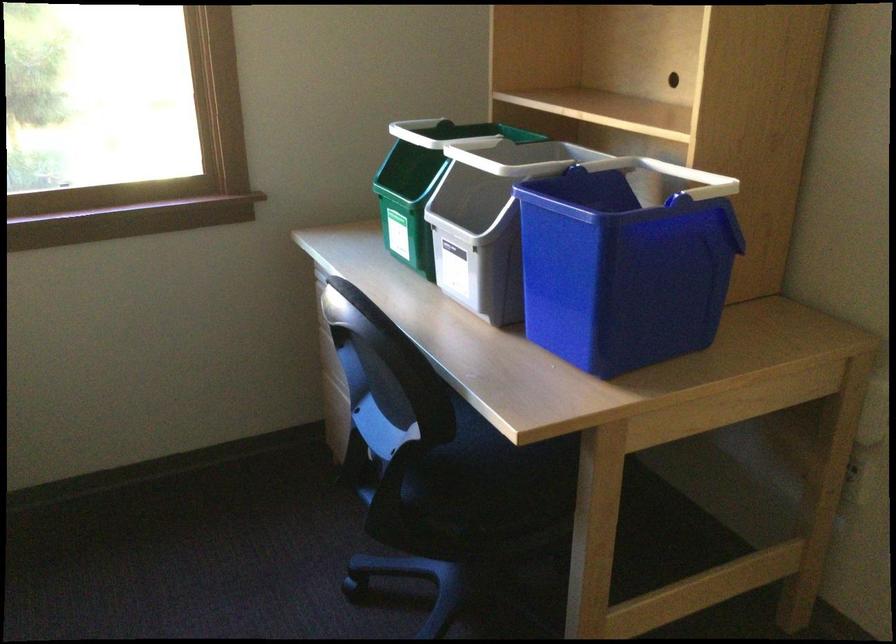
Locate an element on the screen. This screenshot has height=644, width=896. black chair armrest is located at coordinates click(460, 494).